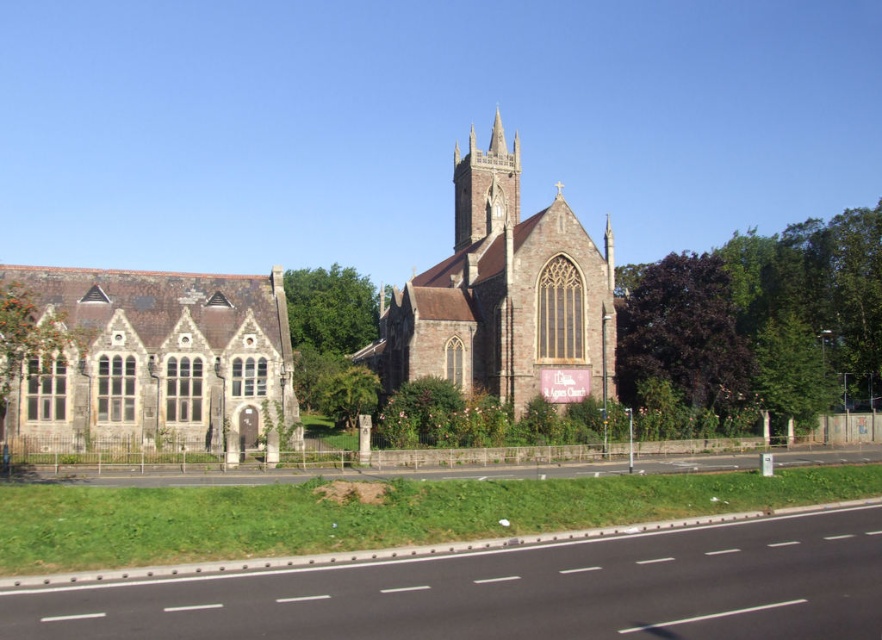
Question: Which point appears closest to the camera in this image?

Choices:
 (A) (126, 292)
 (B) (464, 173)
 (C) (501, 285)

Answer: (A)

Question: Is brown stone church at center smaller than smooth brick spire at center?

Choices:
 (A) yes
 (B) no

Answer: (B)

Question: Which of the following is the closest to the observer?

Choices:
 (A) brown stone church at center
 (B) smooth brick spire at center
 (C) stone church at left

Answer: (C)

Question: Does stone church at left come in front of brown stone church at center?

Choices:
 (A) yes
 (B) no

Answer: (A)

Question: Is the position of stone church at left less distant than that of brown stone church at center?

Choices:
 (A) no
 (B) yes

Answer: (B)

Question: Which point is closer to the camera?

Choices:
 (A) brown stone church at center
 (B) stone church at left

Answer: (B)